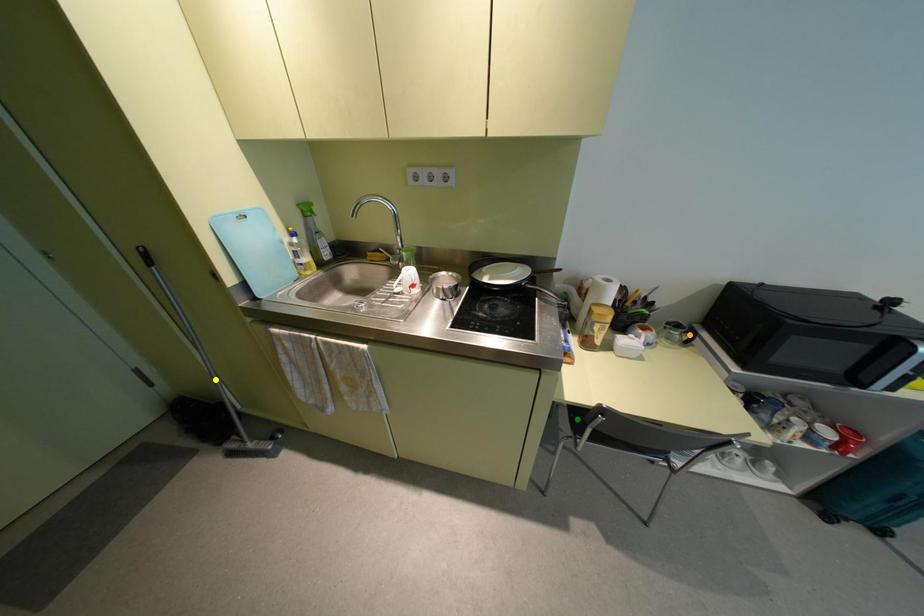
Order these from nearest to farthest:
- yellow point
- orange point
- green point

yellow point
orange point
green point